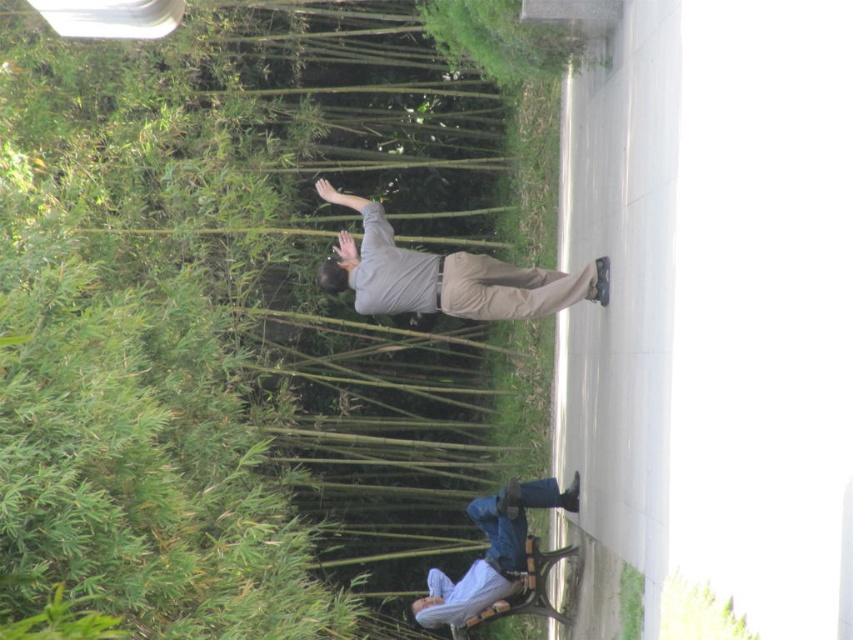
Is blue denim jeans at lower right in front of khaki pants at center?

No.

Who is higher up, blue denim jeans at lower right or khaki pants at center?

khaki pants at center is above.

Where is `blue denim jeans at lower right`? The image size is (853, 640). blue denim jeans at lower right is located at coordinates (496, 557).

Does green bamboo at upper left have a lesser width compared to gray matte shirt at center?

Incorrect, green bamboo at upper left's width is not less than gray matte shirt at center's.

Measure the distance between green bamboo at upper left and camera.

green bamboo at upper left and camera are 14.19 feet apart from each other.

Identify the location of green bamboo at upper left. (216, 323).

Between gray matte shirt at center and blue denim jeans at lower right, which one is positioned higher?

gray matte shirt at center is higher up.

Which of these two, gray matte shirt at center or blue denim jeans at lower right, stands shorter?

gray matte shirt at center is shorter.

Does point (366, 237) lie in front of point (519, 584)?

No.

Locate an element on the screen. The image size is (853, 640). gray matte shirt at center is located at coordinates (445, 275).